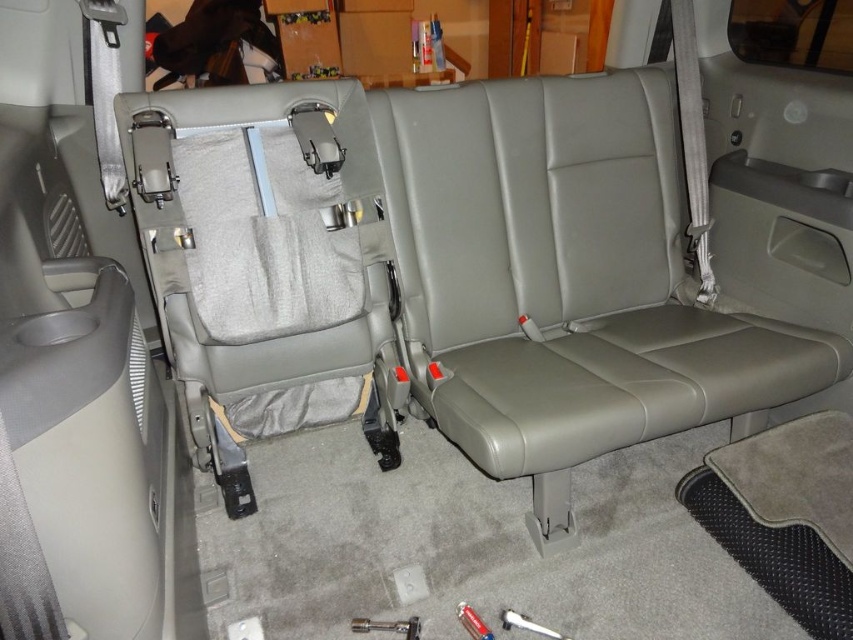
Question: Does metallic silver wrench at center appear on the left side of metallic silver screwdriver at center?

Choices:
 (A) no
 (B) yes

Answer: (B)

Question: Which point is farther to the camera?

Choices:
 (A) white plastic screwdriver at lower center
 (B) metallic silver wrench at center

Answer: (A)

Question: Is metallic silver wrench at center thinner than white plastic screwdriver at lower center?

Choices:
 (A) yes
 (B) no

Answer: (B)

Question: Which point is closer to the camera?

Choices:
 (A) metallic silver wrench at center
 (B) white plastic screwdriver at lower center

Answer: (A)

Question: Considering the real-world distances, which object is closest to the metallic silver screwdriver at center?

Choices:
 (A) white plastic screwdriver at lower center
 (B) metallic silver wrench at center

Answer: (A)

Question: Does white plastic screwdriver at lower center appear under metallic silver screwdriver at center?

Choices:
 (A) no
 (B) yes

Answer: (B)